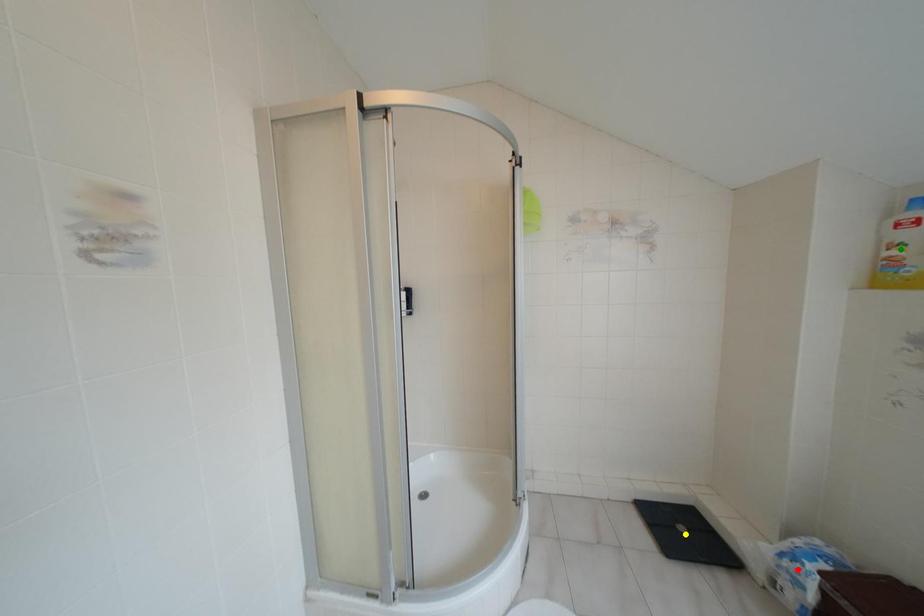
Order these from nearest to farthest:
A) yellow point
B) green point
C) red point

green point → red point → yellow point